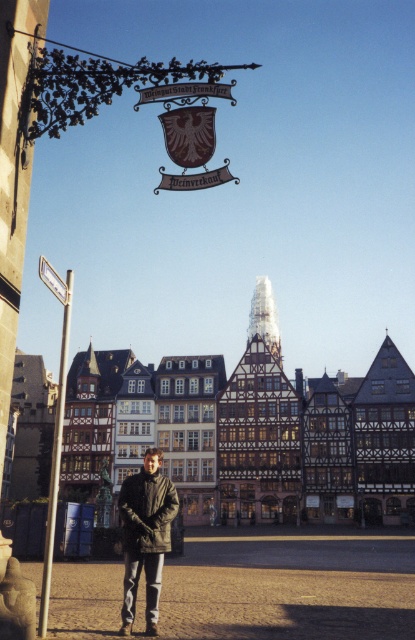
Is dark gray jacket at center to the right of silver metallic pole at left from the viewer's perspective?

Yes, dark gray jacket at center is to the right of silver metallic pole at left.

Which is in front, point (153, 616) or point (56, 472)?

Point (56, 472) is more forward.

Between point (131, 488) and point (66, 326), which one is positioned behind?

Point (66, 326)

This screenshot has height=640, width=415. Identify the location of dark gray jacket at center. (146, 536).

How much distance is there between silver metallic pole at left and white plastic street sign at left?

A distance of 48.37 feet exists between silver metallic pole at left and white plastic street sign at left.

Is silver metallic pole at left shorter than white plastic street sign at left?

No, silver metallic pole at left is not shorter than white plastic street sign at left.

Is point (61, 298) closer to viewer compared to point (56, 276)?

No.

The width and height of the screenshot is (415, 640). I want to click on silver metallic pole at left, so click(x=55, y=429).

Describe the element at coordinates (146, 536) in the screenshot. I see `dark gray jacket at center` at that location.

Does point (158, 582) lie behind point (41, 256)?

No, (158, 582) is in front of (41, 256).

At what (x,y) coordinates should I click in order to perform the action: click on dark gray jacket at center. Please return your answer as a coordinate pair (x, y). This screenshot has width=415, height=640. Looking at the image, I should click on (146, 536).